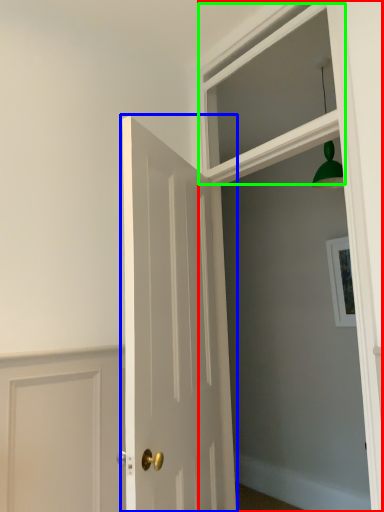
Question: Which is farther away from window frame (highlighted by a red box)? door (highlighted by a blue box) or window (highlighted by a green box)?

Choices:
 (A) door
 (B) window

Answer: (A)